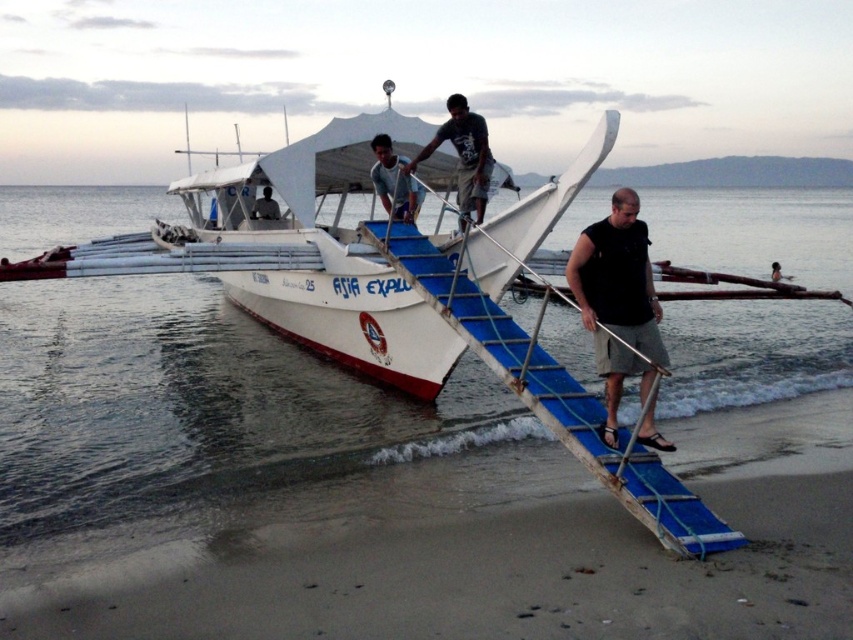
You are a photographer standing on the beach and want to capture both the black fabric shirt at center and the smooth skin person at lower right in the same frame. Based on their positions, which object should you adjust your camera to focus on first to ensure both are in the shot?

The black fabric shirt at center is to the left of the smooth skin person at lower right, so you should focus on the smooth skin person at lower right first to ensure both are in the shot.

You are a photographer trying to capture the entire scene of the beach with the boat and the ramp. However, your camera has a limited field of view. Given that the clear water at lower left is larger in size compared to the smooth skin person at lower right, which object should you focus on to ensure both are visible in the frame?

The clear water at lower left is bigger than the smooth skin person at lower right, so focusing on the larger clear water at lower left will help ensure both objects fit within the camera frame.